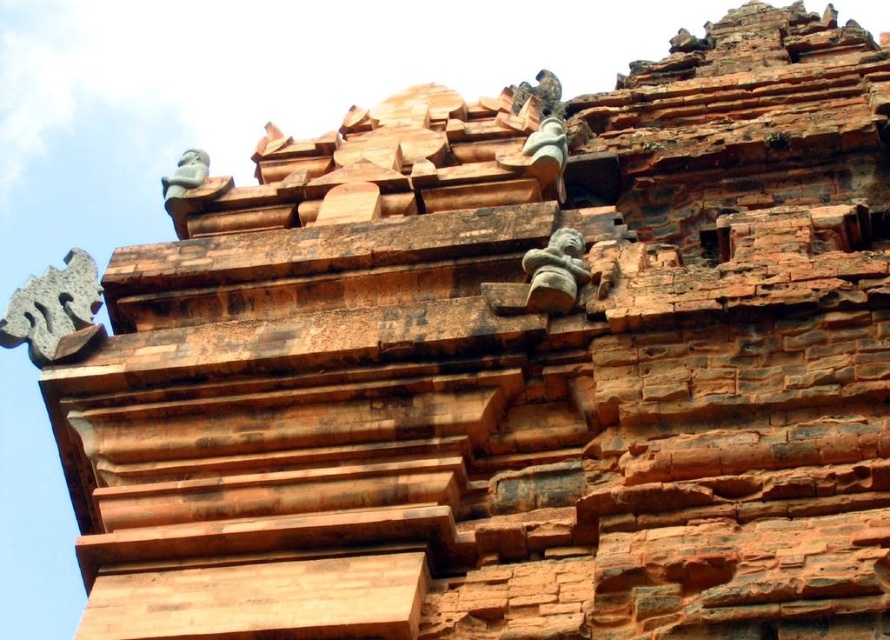
You are an architect examining the ancient brick structure. You notice the gray stone dragon at left and the smooth stone figure at upper left. Which of these two decorative elements has a greater width?

The gray stone dragon at left has a greater width than the smooth stone figure at upper left.